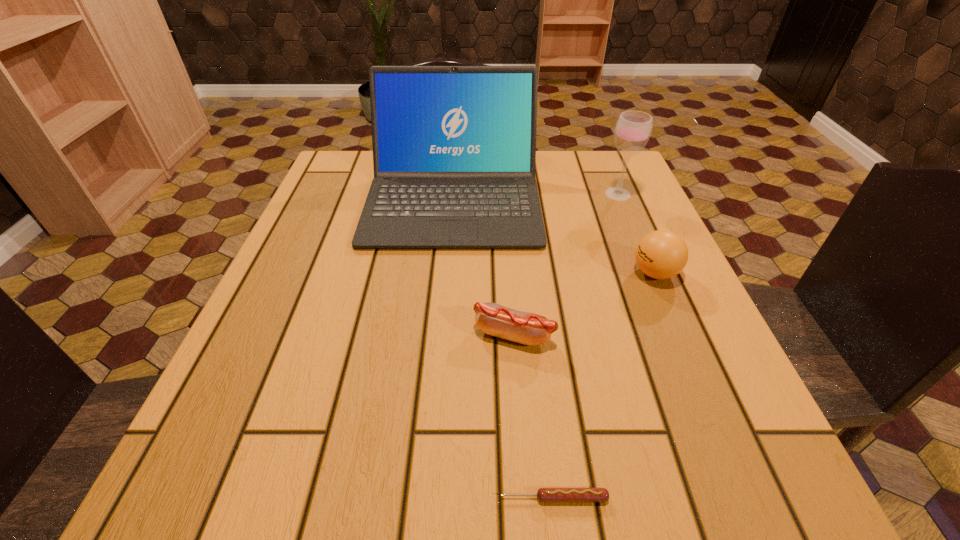
Locate which object ranks fourth in proximity to the wineglass. Please provide its 2D coordinates. Your answer should be formatted as a tuple, i.e. [(x, y)], where the tuple contains the x and y coordinates of a point satisfying the conditions above.

[(545, 495)]

In order to click on free location that satisfies the following two spatial constraints: 1. on the screen of the taller sausage; 2. on the right side of the tallest object in this screenshot , I will do `click(443, 335)`.

Locate an element on the screen. The image size is (960, 540). vacant space that satisfies the following two spatial constraints: 1. on the front side of the nearest object; 2. on the left side of the second shortest object is located at coordinates (525, 498).

Find the location of a particular element. This screenshot has width=960, height=540. vacant space that satisfies the following two spatial constraints: 1. on the screen of the tallest object; 2. on the right side of the nearer sausage is located at coordinates (429, 498).